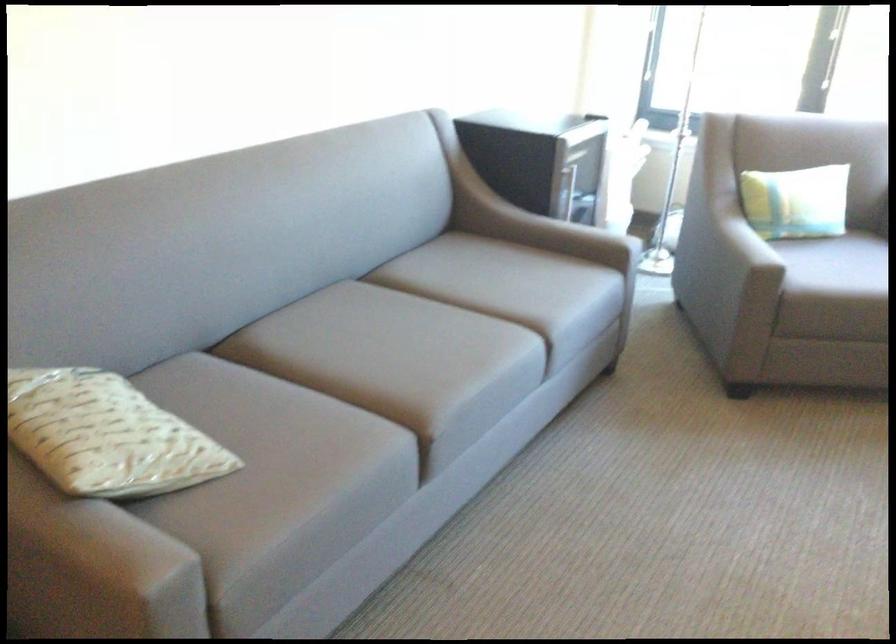
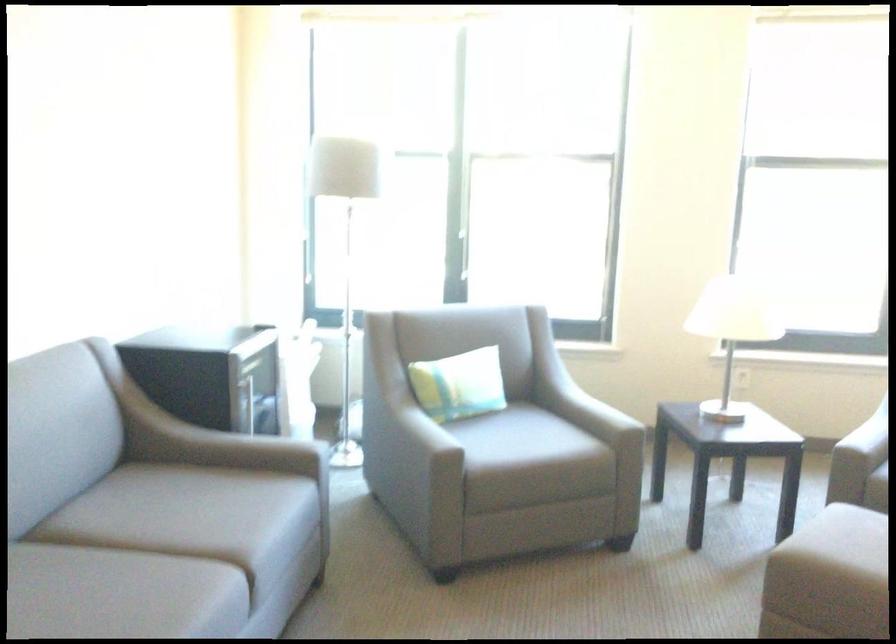
Question: The images are taken continuously from a first-person perspective. In which direction are you moving?

Choices:
 (A) Left
 (B) Right
 (C) Forward
 (D) Backward

Answer: (B)